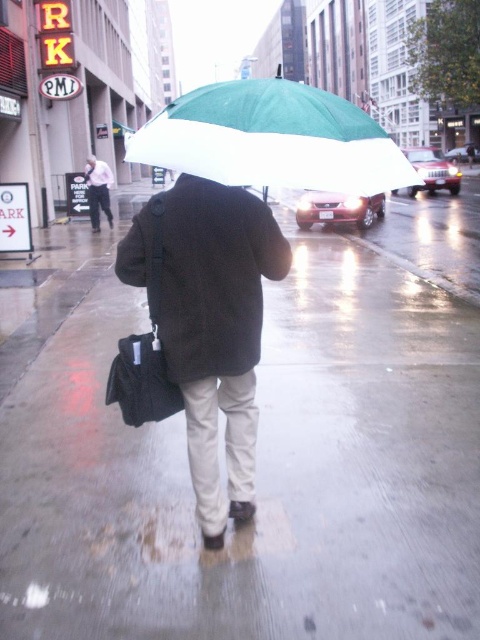
Who is more distant from viewer, (15, 307) or (267, 161)?

Positioned behind is point (15, 307).

The width and height of the screenshot is (480, 640). I want to click on wet asphalt sidewalk at center, so click(x=256, y=460).

Can you confirm if green/white fabric umbrella at upper center is wider than light pink shirt at upper left?

Yes, green/white fabric umbrella at upper center is wider than light pink shirt at upper left.

Image resolution: width=480 pixels, height=640 pixels. What are the coordinates of `green/white fabric umbrella at upper center` in the screenshot? It's located at (273, 140).

The width and height of the screenshot is (480, 640). I want to click on green/white fabric umbrella at upper center, so click(273, 140).

Is point (412, 364) positioned before point (128, 282)?

No, it is not.

The width and height of the screenshot is (480, 640). What do you see at coordinates (256, 460) in the screenshot? I see `wet asphalt sidewalk at center` at bounding box center [256, 460].

The height and width of the screenshot is (640, 480). Find the location of `wet asphalt sidewalk at center`. wet asphalt sidewalk at center is located at coordinates (256, 460).